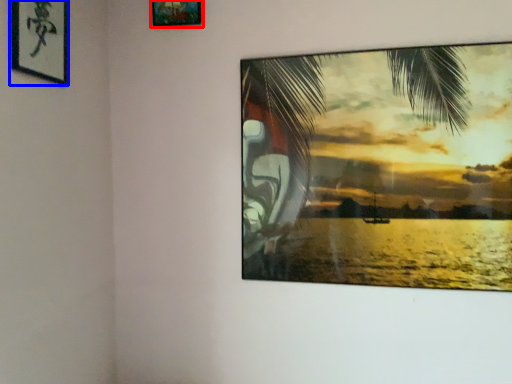
Question: Which object is closer to the camera taking this photo, picture frame (highlighted by a red box) or picture frame (highlighted by a blue box)?

Choices:
 (A) picture frame
 (B) picture frame

Answer: (B)